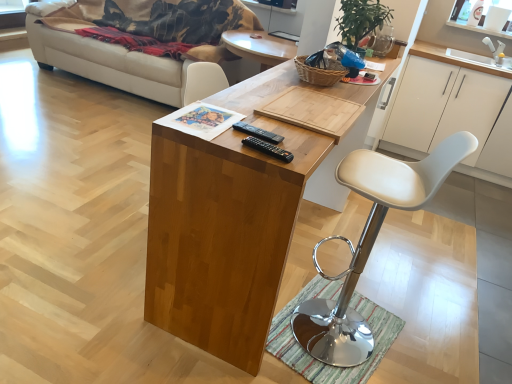
Where is `free spot above striped fabric mat at lower center (from a real-world perspective)`? This screenshot has width=512, height=384. free spot above striped fabric mat at lower center (from a real-world perspective) is located at coordinates (327, 333).